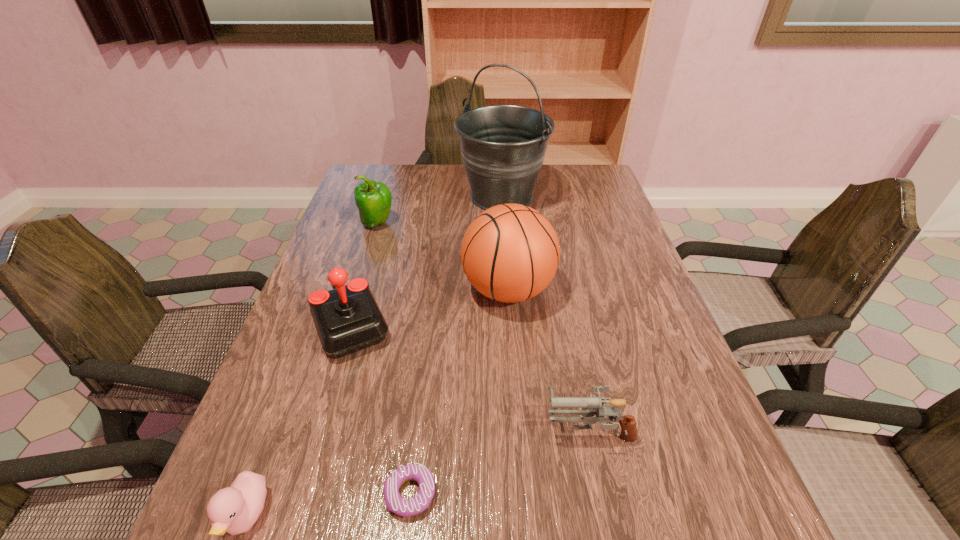
You are a GUI agent. You are given a task and a screenshot of the screen. Output one action in this format:
    pyautogui.click(x=<x>, y=<y>)
    Task: Click on the tallest object
    
    Given the screenshot: What is the action you would take?
    (503, 147)

Identify the location of basketball. (510, 253).

At what (x,y) coordinates should I click in order to perform the action: click on joystick. Please return your answer as a coordinate pair (x, y). The image size is (960, 540). Looking at the image, I should click on (347, 318).

You are a GUI agent. You are given a task and a screenshot of the screen. Output one action in this format:
    pyautogui.click(x=<x>, y=<y>)
    Task: Click on the bell pepper
    
    Given the screenshot: What is the action you would take?
    pyautogui.click(x=373, y=199)

Where is `the fifth tallest object`? The image size is (960, 540). the fifth tallest object is located at coordinates (591, 406).

Find the location of a particular element. Image resolution: width=960 pixels, height=540 pixels. the fifth farthest object is located at coordinates (591, 406).

You are a GUI agent. You are given a task and a screenshot of the screen. Output one action in this format:
    pyautogui.click(x=<x>, y=<y>)
    Task: Click on the doughnut
    The height and width of the screenshot is (540, 960).
    Given the screenshot: What is the action you would take?
    pyautogui.click(x=401, y=506)

The image size is (960, 540). Identify the location of vacant region located 0.090m on the left of the bucket. (429, 197).

The image size is (960, 540). What are the coordinates of `vacant area situated on the back of the second tallest object` in the screenshot? It's located at (504, 237).

You are a GUI agent. You are given a task and a screenshot of the screen. Output one action in this format:
    pyautogui.click(x=<x>, y=<y>)
    Task: Click on the blank space located on the back of the joystick
    Image resolution: width=960 pixels, height=540 pixels.
    Given the screenshot: What is the action you would take?
    pyautogui.click(x=367, y=276)